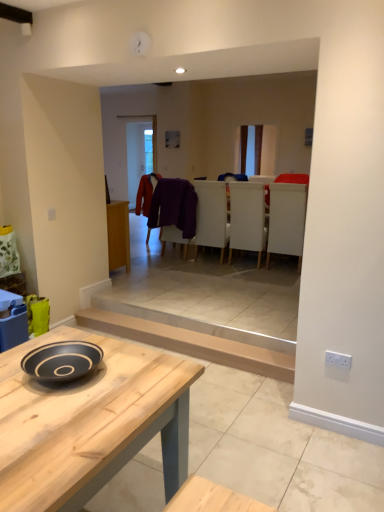
Describe the element at coordinates (193, 343) in the screenshot. Image resolution: width=384 pixels, height=512 pixels. I see `light brown wooden plank at lower center` at that location.

Where is `white matte chair at center`? The height and width of the screenshot is (512, 384). white matte chair at center is located at coordinates (247, 218).

At what (x,y) coordinates should I click in order to perform the action: click on velvet red coat at center, the first laundry positioned from the back. Please return your answer as a coordinate pair (x, y). Looking at the image, I should click on (146, 192).

Is purple fabric at center, the 2th laundry when ordered from back to front, situated inside white matte chair at center or outside?

The correct answer is: outside.

Is purple fabric at center, which appears as the 1th laundry when viewed from the front, taller or shorter than white matte chair at center?

purple fabric at center, which appears as the 1th laundry when viewed from the front, is shorter than white matte chair at center.

Looking at this image, how far apart are purple fabric at center, the 2th laundry when ordered from back to front, and white matte chair at center?

29.65 inches.

From the image's perspective, relative to white matte chair at center, is purple fabric at center, which appears as the 1th laundry when viewed from the front, above or below?

Clearly, from the image's perspective, purple fabric at center, which appears as the 1th laundry when viewed from the front, is above white matte chair at center.

Is purple fabric at center, the 2th laundry when ordered from back to front, facing towards white fabric armchair at center, which is counted as the 2th armchair, starting from the left?

No, purple fabric at center, the 2th laundry when ordered from back to front, does not turn towards white fabric armchair at center, which is counted as the 2th armchair, starting from the left.

From a real-world perspective, is purple fabric at center, which appears as the 1th laundry when viewed from the front, positioned over white fabric armchair at center, which is counted as the 2th armchair, starting from the left, based on gravity?

Indeed, from a real-world perspective, purple fabric at center, which appears as the 1th laundry when viewed from the front, stands above white fabric armchair at center, which is counted as the 2th armchair, starting from the left.

There is a white fabric armchair at center, which is counted as the 2th armchair, starting from the left. Where is `the 1st laundry above it (from the image's perspective)`? This screenshot has height=512, width=384. the 1st laundry above it (from the image's perspective) is located at coordinates (174, 206).

Is purple fabric at center, which appears as the 1th laundry when viewed from the front, taller than white fabric armchair at center, which is counted as the 2th armchair, starting from the left?

In fact, purple fabric at center, which appears as the 1th laundry when viewed from the front, may be shorter than white fabric armchair at center, which is counted as the 2th armchair, starting from the left.

Is purple fabric at center, which appears as the 1th laundry when viewed from the front, beside white leather armchair at center, marked as the 2th armchair in a right-to-left arrangement?

purple fabric at center, which appears as the 1th laundry when viewed from the front, and white leather armchair at center, marked as the 2th armchair in a right-to-left arrangement, are clearly separated.

What's the angular difference between purple fabric at center, the 2th laundry when ordered from back to front, and white leather armchair at center, positioned as the first armchair in left-to-right order,'s facing directions?

The facing directions of purple fabric at center, the 2th laundry when ordered from back to front, and white leather armchair at center, positioned as the first armchair in left-to-right order, are 0.000117 degrees apart.

Between purple fabric at center, which appears as the 1th laundry when viewed from the front, and white leather armchair at center, positioned as the first armchair in left-to-right order, which one appears on the left side from the viewer's perspective?

purple fabric at center, which appears as the 1th laundry when viewed from the front, is more to the left.

Is purple fabric at center, the 2th laundry when ordered from back to front, positioned with its back to white leather armchair at center, positioned as the first armchair in left-to-right order?

No, white leather armchair at center, positioned as the first armchair in left-to-right order, is not at the back of purple fabric at center, the 2th laundry when ordered from back to front.

Can we say velvet red coat at center, which is the 2th laundry from front to back, lies outside white leather armchair at center, positioned as the first armchair in left-to-right order?

velvet red coat at center, which is the 2th laundry from front to back, lies outside white leather armchair at center, positioned as the first armchair in left-to-right order,'s area.

Is velvet red coat at center, which is the 2th laundry from front to back, looking in the opposite direction of white leather armchair at center, positioned as the first armchair in left-to-right order?

No.

Which point is more distant from viewer, (143, 179) or (202, 182)?

Positioned behind is point (202, 182).

Between velvet red coat at center, which is the 2th laundry from front to back, and white leather armchair at center, positioned as the first armchair in left-to-right order, which one is positioned behind?

velvet red coat at center, which is the 2th laundry from front to back, is further away from the camera.

Consider the image. Can you see velvet red coat at center, which is the 2th laundry from front to back, touching white fabric armchair at center, which is counted as the 2th armchair, starting from the left?

No, velvet red coat at center, which is the 2th laundry from front to back, is not in contact with white fabric armchair at center, which is counted as the 2th armchair, starting from the left.

Considering the sizes of objects velvet red coat at center, which is the 2th laundry from front to back, and white fabric armchair at center, the 1th armchair from the right, in the image provided, who is wider, velvet red coat at center, which is the 2th laundry from front to back, or white fabric armchair at center, the 1th armchair from the right,?

Wider between the two is white fabric armchair at center, the 1th armchair from the right.

From a real-world perspective, is velvet red coat at center, which is the 2th laundry from front to back, under white fabric armchair at center, the 1th armchair from the right?

No.

Which point is more distant from viewer, [135,212] or [302,183]?

The point [135,212] is more distant.

Does natural wood table at center have a larger size compared to light brown wooden plank at lower center?

Yes, natural wood table at center is bigger than light brown wooden plank at lower center.

Is natural wood table at center beside light brown wooden plank at lower center?

There is a gap between natural wood table at center and light brown wooden plank at lower center.

Can you confirm if natural wood table at center is taller than light brown wooden plank at lower center?

Correct, natural wood table at center is much taller as light brown wooden plank at lower center.

Considering their positions, is natural wood table at center located in front of or behind light brown wooden plank at lower center?

In the image, natural wood table at center appears in front of light brown wooden plank at lower center.

Which is more to the right, white fabric armchair at center, which is counted as the 2th armchair, starting from the left, or velvet red coat at center, the first laundry positioned from the back?

Positioned to the right is white fabric armchair at center, which is counted as the 2th armchair, starting from the left.

Considering the points (273, 213) and (148, 205), which point is behind, point (273, 213) or point (148, 205)?

Point (148, 205)

Does white fabric armchair at center, which is counted as the 2th armchair, starting from the left, have a smaller size compared to velvet red coat at center, which is the 2th laundry from front to back?

No, white fabric armchair at center, which is counted as the 2th armchair, starting from the left, is not smaller than velvet red coat at center, which is the 2th laundry from front to back.

From the image's perspective, is white fabric armchair at center, the 1th armchair from the right, above velvet red coat at center, the first laundry positioned from the back?

Actually, white fabric armchair at center, the 1th armchair from the right, appears below velvet red coat at center, the first laundry positioned from the back, in the image.

Where is `chair below the purple fabric at center, which appears as the 1th laundry when viewed from the front (from a real-world perspective)`? chair below the purple fabric at center, which appears as the 1th laundry when viewed from the front (from a real-world perspective) is located at coordinates point(247,218).

Locate an element on the screen. This screenshot has height=512, width=384. the 1st laundry to the left of the white fabric armchair at center, the 1th armchair from the right, starting your count from the anchor is located at coordinates (174, 206).

Considering their positions, is white leather armchair at center, marked as the 2th armchair in a right-to-left arrangement, positioned further to purple fabric at center, the 2th laundry when ordered from back to front, than light brown wooden plank at lower center?

light brown wooden plank at lower center is positioned further to the anchor purple fabric at center, the 2th laundry when ordered from back to front.

Estimate the real-world distances between objects in this image. Which object is closer to velvet red coat at center, the first laundry positioned from the back, purple fabric at center, which appears as the 1th laundry when viewed from the front, or white matte chair at center?

Result: purple fabric at center, which appears as the 1th laundry when viewed from the front, is closer to velvet red coat at center, the first laundry positioned from the back.

In the scene shown: Looking at the image, which one is located further to natural wood table at center, purple fabric at center, the 2th laundry when ordered from back to front, or velvet red coat at center, the first laundry positioned from the back?

Based on the image, velvet red coat at center, the first laundry positioned from the back, appears to be further to natural wood table at center.

Looking at this image, which object lies further to the anchor point white fabric armchair at center, the 1th armchair from the right, white matte chair at center or white leather armchair at center, marked as the 2th armchair in a right-to-left arrangement?

white leather armchair at center, marked as the 2th armchair in a right-to-left arrangement, is further to white fabric armchair at center, the 1th armchair from the right.

Considering their positions, is white matte chair at center positioned closer to light brown wooden plank at lower center than white leather armchair at center, marked as the 2th armchair in a right-to-left arrangement?

white leather armchair at center, marked as the 2th armchair in a right-to-left arrangement.

In the scene shown: Looking at the image, which one is located further to natural wood table at center, white matte chair at center or white leather armchair at center, marked as the 2th armchair in a right-to-left arrangement?

white leather armchair at center, marked as the 2th armchair in a right-to-left arrangement, is positioned further to the anchor natural wood table at center.

Considering their positions, is white matte chair at center positioned further to velvet red coat at center, which is the 2th laundry from front to back, than purple fabric at center, the 2th laundry when ordered from back to front?

white matte chair at center is positioned further to the anchor velvet red coat at center, which is the 2th laundry from front to back.

From the image, which object appears to be farther from white matte chair at center, purple fabric at center, which appears as the 1th laundry when viewed from the front, or white leather armchair at center, marked as the 2th armchair in a right-to-left arrangement?

Based on the image, purple fabric at center, which appears as the 1th laundry when viewed from the front, appears to be further to white matte chair at center.

This screenshot has height=512, width=384. Find the location of `chair between velvet red coat at center, the first laundry positioned from the back, and white fabric armchair at center, the 1th armchair from the right`. chair between velvet red coat at center, the first laundry positioned from the back, and white fabric armchair at center, the 1th armchair from the right is located at coordinates (247, 218).

This screenshot has width=384, height=512. What are the coordinates of `plank located between natural wood table at center and white leather armchair at center, marked as the 2th armchair in a right-to-left arrangement, in the depth direction` in the screenshot? It's located at (193, 343).

Locate an element on the screen. This screenshot has width=384, height=512. plank positioned between natural wood table at center and white matte chair at center from near to far is located at coordinates (193, 343).

Identify the location of armchair positioned between light brown wooden plank at lower center and white leather armchair at center, marked as the 2th armchair in a right-to-left arrangement, from near to far. The width and height of the screenshot is (384, 512). (287, 218).